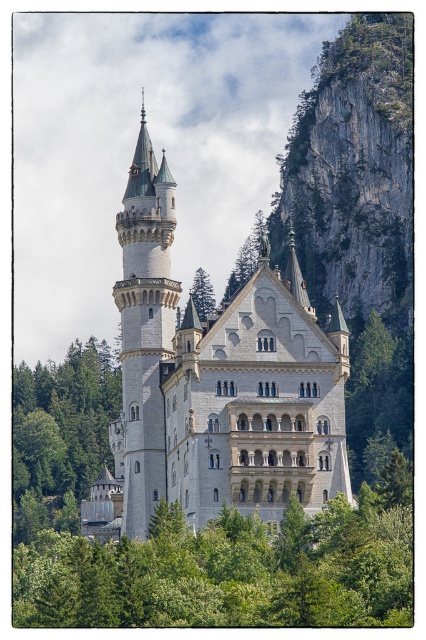
Does white stone tower at center-left appear over green leafy tree at lower left?

Yes.

Is point (157, 291) behind point (86, 490)?

No, it is not.

Which is behind, point (152, 227) or point (37, 416)?

The point (37, 416) is more distant.

The height and width of the screenshot is (640, 426). In order to click on white stone tower at center-left in this screenshot , I will do `click(143, 332)`.

Is white stone tower at center-left wider than green leafy tree at right?

Yes, white stone tower at center-left is wider than green leafy tree at right.

Does white stone tower at center-left lie behind green leafy tree at right?

No.

Locate an element on the screen. This screenshot has height=640, width=426. white stone tower at center-left is located at coordinates (143, 332).

Can you confirm if green leafy tree at center is positioned above green leafy tree at lower left?

No, green leafy tree at center is not above green leafy tree at lower left.

Between green leafy tree at center and green leafy tree at lower left, which one appears on the right side from the viewer's perspective?

From the viewer's perspective, green leafy tree at center appears more on the right side.

Is point (374, 596) farther from camera compared to point (37, 522)?

That is False.

Locate an element on the screen. This screenshot has width=426, height=640. green leafy tree at center is located at coordinates pos(232,566).